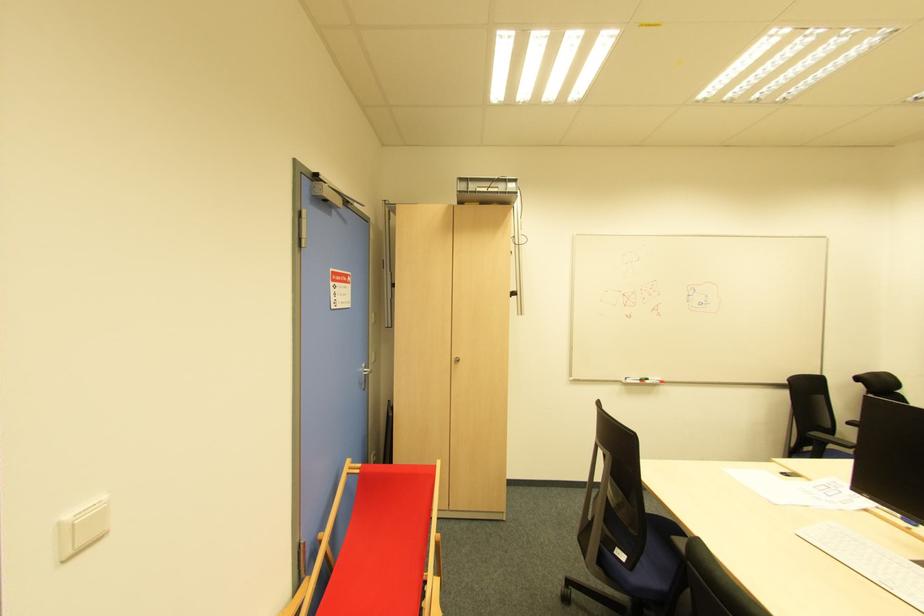
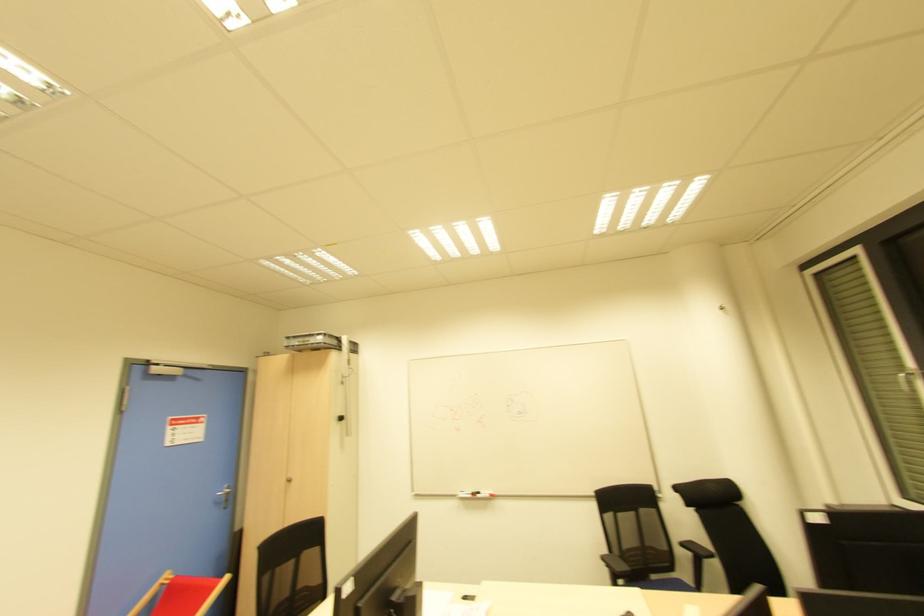
Locate, in the second image, the point that corresponds to point 366,382 in the first image.

(225, 501)